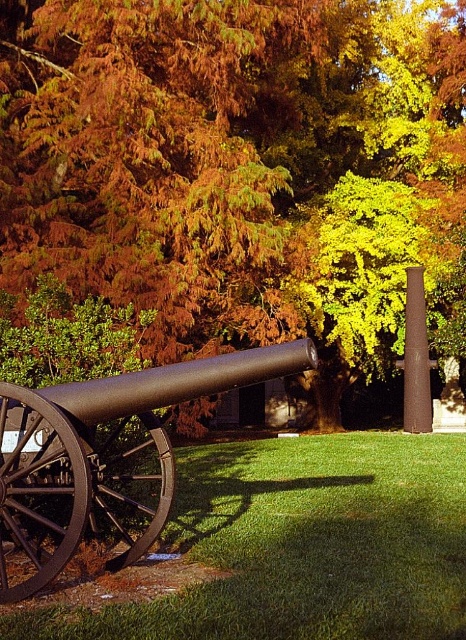
From the picture: Who is positioned more to the left, matte black cannon at lower left or rusty metal pole at center right?

matte black cannon at lower left is more to the left.

Which is behind, point (120, 524) or point (409, 330)?

The point (409, 330) is behind.

The width and height of the screenshot is (466, 640). I want to click on matte black cannon at lower left, so click(x=102, y=460).

Is the position of orange-brown foliage at center more distant than that of matte black cannon at lower left?

Yes, orange-brown foliage at center is behind matte black cannon at lower left.

Does point (221, 316) come closer to viewer compared to point (244, 353)?

No, (221, 316) is further to viewer.

The image size is (466, 640). What are the coordinates of `orange-brown foliage at center` in the screenshot? It's located at (214, 150).

Based on the photo, which of these two, orange-brown foliage at center or rusty metal pole at center right, stands shorter?

Standing shorter between the two is rusty metal pole at center right.

What do you see at coordinates (214, 150) in the screenshot? I see `orange-brown foliage at center` at bounding box center [214, 150].

Where is `orange-brown foliage at center`? The width and height of the screenshot is (466, 640). orange-brown foliage at center is located at coordinates (214, 150).